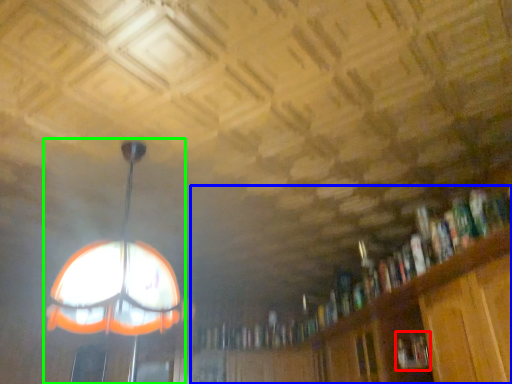
Question: Which object is the farthest from book (highlighted by a red box)? Choose among these: bookcase (highlighted by a blue box) or lamp (highlighted by a green box).

Choices:
 (A) bookcase
 (B) lamp

Answer: (B)